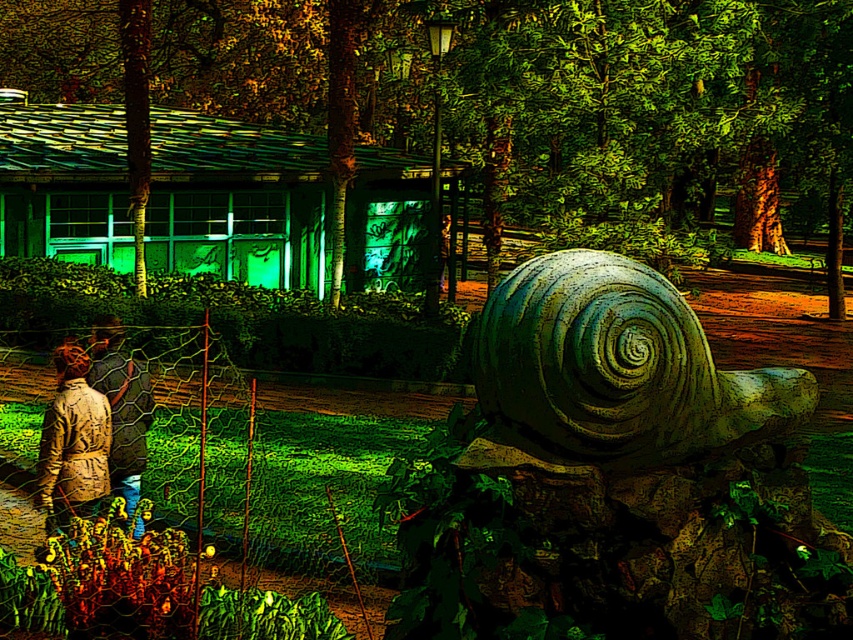
Can you confirm if greenish marble snail at center is positioned below camouflage-patterned jacket at lower left?

Actually, greenish marble snail at center is above camouflage-patterned jacket at lower left.

Between greenish marble snail at center and camouflage-patterned jacket at lower left, which one has more height?

Standing taller between the two is camouflage-patterned jacket at lower left.

Between point (544, 262) and point (76, 497), which one is positioned in front?

Point (544, 262) is more forward.

This screenshot has height=640, width=853. I want to click on greenish marble snail at center, so click(614, 369).

Does greenish marble snail at center appear on the right side of camouflage jacket at lower left?

Yes, greenish marble snail at center is to the right of camouflage jacket at lower left.

The image size is (853, 640). What do you see at coordinates (614, 369) in the screenshot? I see `greenish marble snail at center` at bounding box center [614, 369].

You are a GUI agent. You are given a task and a screenshot of the screen. Output one action in this format:
    pyautogui.click(x=<x>, y=<y>)
    Task: Click on the greenish marble snail at center
    Image resolution: width=853 pixels, height=640 pixels.
    Given the screenshot: What is the action you would take?
    tap(614, 369)

Which of these two, camouflage-patterned jacket at lower left or camouflage jacket at lower left, stands taller?

camouflage jacket at lower left is taller.

Is point (79, 442) in front of point (103, 321)?

Yes, point (79, 442) is closer to viewer.

Is point (86, 440) in front of point (120, 442)?

Yes, it is in front of point (120, 442).

This screenshot has height=640, width=853. What are the coordinates of `camouflage-patterned jacket at lower left` in the screenshot? It's located at (73, 442).